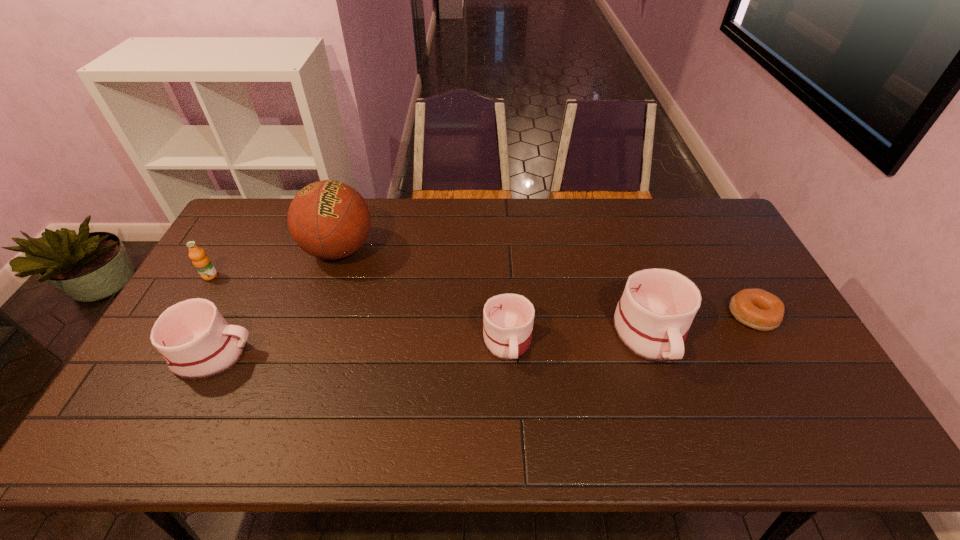
Locate an element on the screen. This screenshot has height=540, width=960. free space between the shortest mug and the basketball is located at coordinates (423, 295).

Where is `vacant space that is in between the fifth object from left to right and the shortest object`? Image resolution: width=960 pixels, height=540 pixels. vacant space that is in between the fifth object from left to right and the shortest object is located at coordinates (701, 325).

Locate an element on the screen. This screenshot has width=960, height=540. unoccupied area between the rightmost mug and the leftmost mug is located at coordinates (431, 344).

Locate an element on the screen. The width and height of the screenshot is (960, 540). object that ranks as the fourth closest to the orange juice is located at coordinates (652, 319).

The image size is (960, 540). Identify the location of object identified as the closest to the second mug from right to left. (652, 319).

Find the location of `mug that is the third closest to the bagel`. mug that is the third closest to the bagel is located at coordinates (195, 340).

Select which mug is the third closest to the orange juice. Please provide its 2D coordinates. Your answer should be formatted as a tuple, i.e. [(x, y)], where the tuple contains the x and y coordinates of a point satisfying the conditions above.

[(652, 319)]

This screenshot has width=960, height=540. I want to click on vacant area in the image that satisfies the following two spatial constraints: 1. on the side with the handle of the second mug from right to left; 2. on the side with the handle of the second tallest mug, so click(508, 354).

Where is `free space that satisfies the following two spatial constraints: 1. on the side with the handle of the second shortest object; 2. on the side with the handle of the second tallest mug`? This screenshot has width=960, height=540. free space that satisfies the following two spatial constraints: 1. on the side with the handle of the second shortest object; 2. on the side with the handle of the second tallest mug is located at coordinates (508, 354).